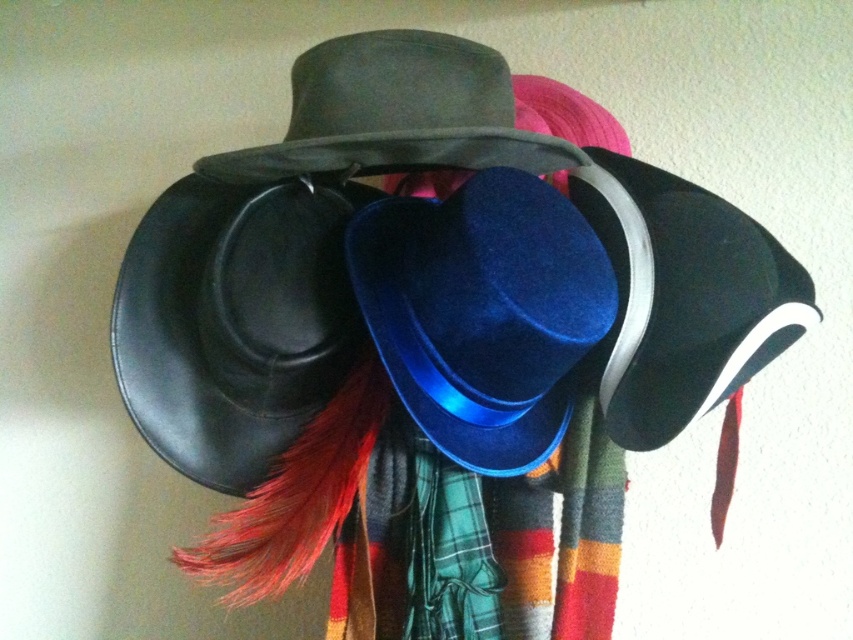
Is the position of velvet blue cowboy hat at center more distant than that of matte black fedora at center?

Yes, velvet blue cowboy hat at center is further from the viewer.

Can you confirm if velvet blue cowboy hat at center is positioned to the right of matte black fedora at center?

Indeed, velvet blue cowboy hat at center is positioned on the right side of matte black fedora at center.

Locate an element on the screen. The image size is (853, 640). velvet blue cowboy hat at center is located at coordinates (483, 312).